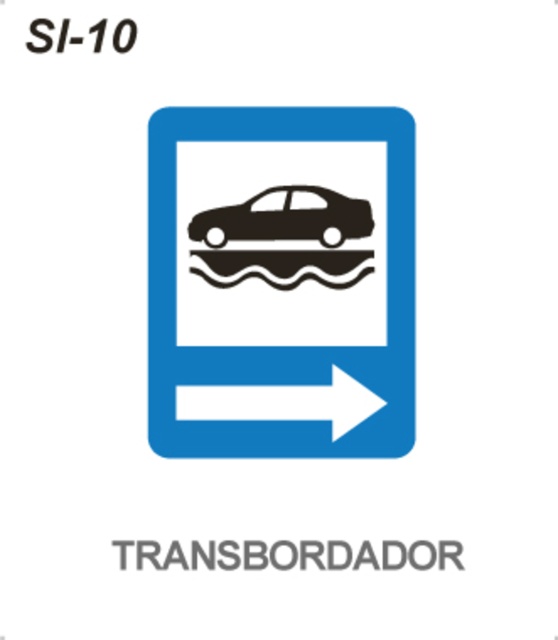
Between black glossy car at center and black text at upper left, which one appears on the left side from the viewer's perspective?

From the viewer's perspective, black text at upper left appears more on the left side.

Which of these two, black glossy car at center or black text at upper left, stands taller?

Standing taller between the two is black glossy car at center.

Is point (344, 209) in front of point (123, 45)?

No.

Locate an element on the screen. The width and height of the screenshot is (558, 640). black glossy car at center is located at coordinates (281, 282).

Who is taller, white glossy arrow at center-right or black text at upper left?

With more height is white glossy arrow at center-right.

Which is in front, point (238, 401) or point (131, 19)?

Positioned in front is point (131, 19).

This screenshot has width=558, height=640. I want to click on white glossy arrow at center-right, so click(x=281, y=403).

Looking at this image, is black matte car at center above black text at upper left?

Actually, black matte car at center is below black text at upper left.

Image resolution: width=558 pixels, height=640 pixels. Describe the element at coordinates (286, 220) in the screenshot. I see `black matte car at center` at that location.

Is point (240, 208) behind point (123, 52)?

Yes, point (240, 208) is farther from viewer.

Locate an element on the screen. The width and height of the screenshot is (558, 640). black matte car at center is located at coordinates (286, 220).